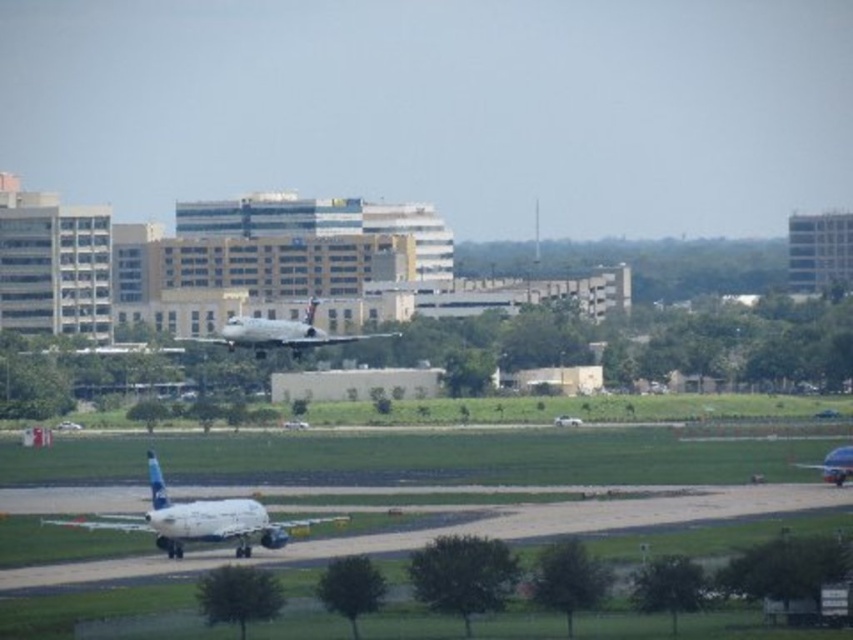
Is point (248, 532) more distant than point (323, 342)?

No, (248, 532) is closer to viewer.

Between white matte airplane at lower left and silver metallic airplane at center, which one has more height?

white matte airplane at lower left is taller.

Image resolution: width=853 pixels, height=640 pixels. What do you see at coordinates (198, 518) in the screenshot? I see `white matte airplane at lower left` at bounding box center [198, 518].

Identify the location of white matte airplane at lower left. The image size is (853, 640). pyautogui.click(x=198, y=518).